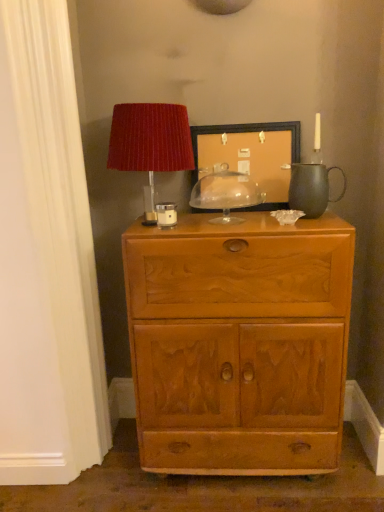
Find the location of a particular element. vacant space behind matte white candle holder at upper center, the 2th candle holder from the right is located at coordinates (188, 215).